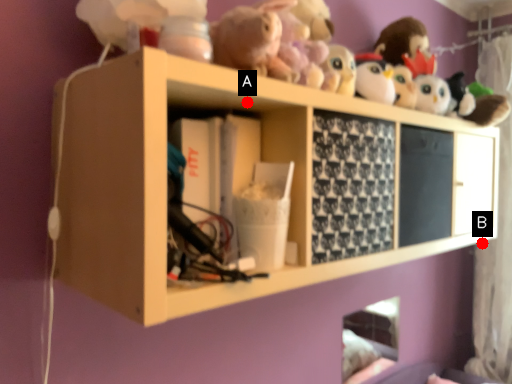
Question: Two points are circled on the image, labeled by A and B beside each circle. Among these points, which one is farthest from the camera?

Choices:
 (A) A is further
 (B) B is further

Answer: (B)